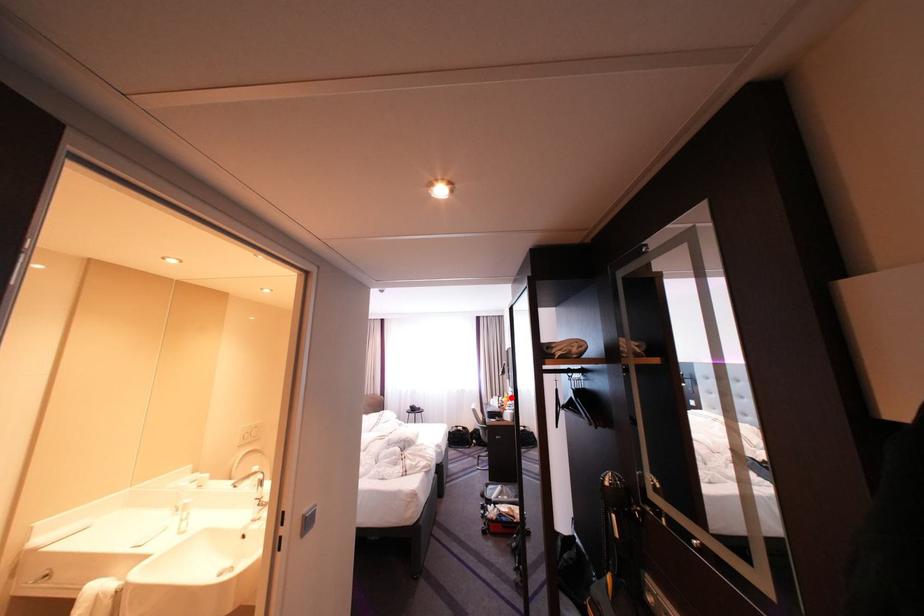
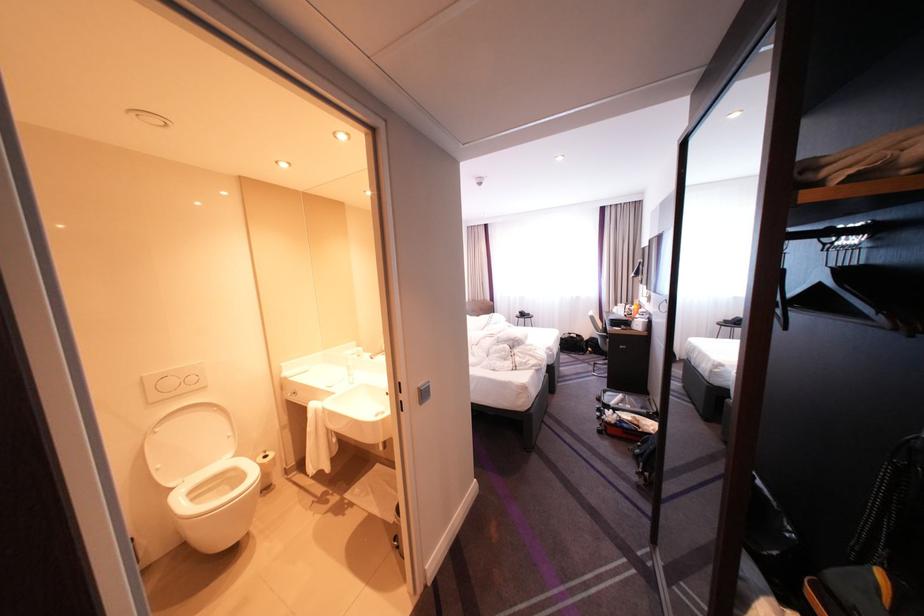
Locate, in the second image, the point that corresponds to the highlighted location in the first image.

(638, 305)